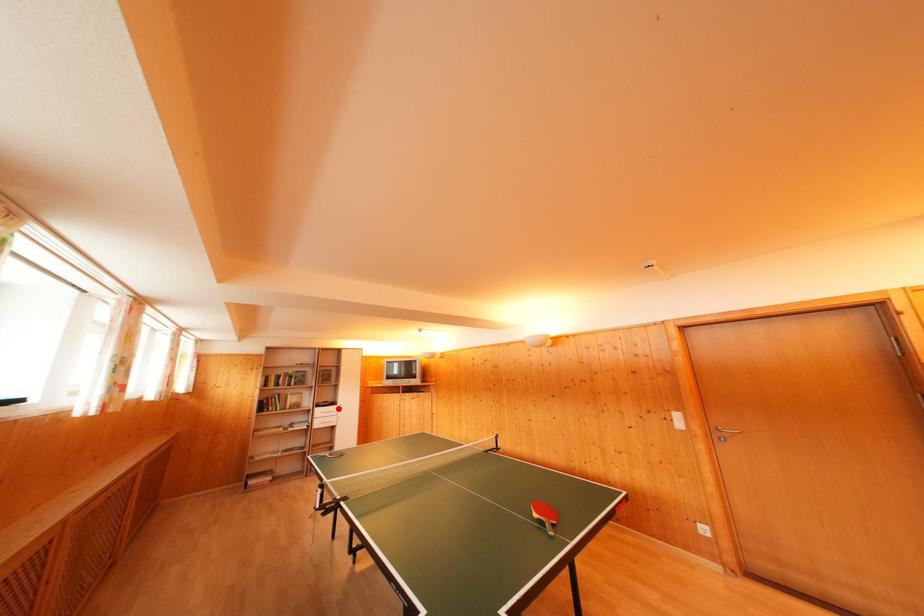
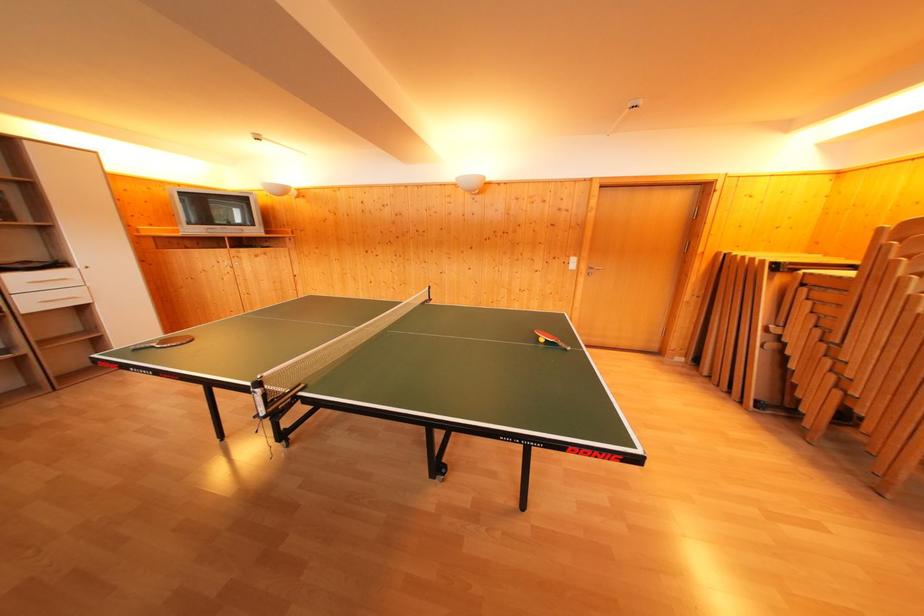
Locate, in the second image, the point that corresponds to the highlighted location in the first image.

(64, 270)